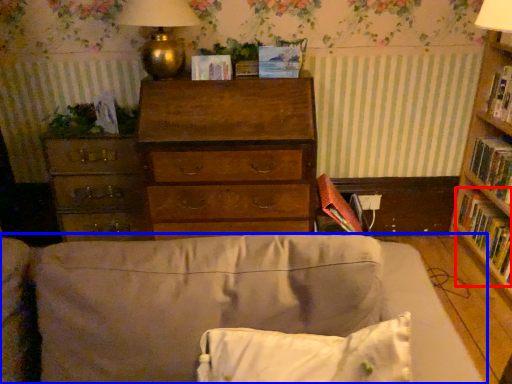
Question: Among these objects, which one is nearest to the camera, book (highlighted by a red box) or studio couch (highlighted by a blue box)?

Choices:
 (A) book
 (B) studio couch

Answer: (B)